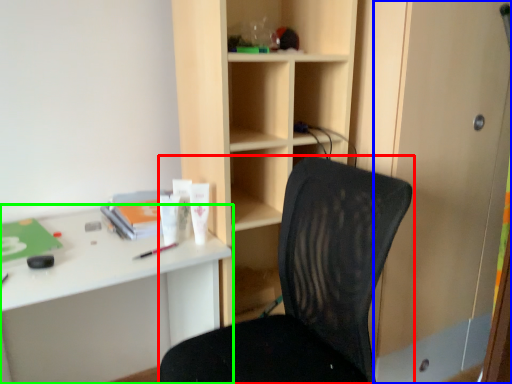
Question: Which object is positioned closest to chair (highlighted by a red box)? Select from screen door (highlighted by a blue box) and desk (highlighted by a green box).

Choices:
 (A) screen door
 (B) desk

Answer: (B)